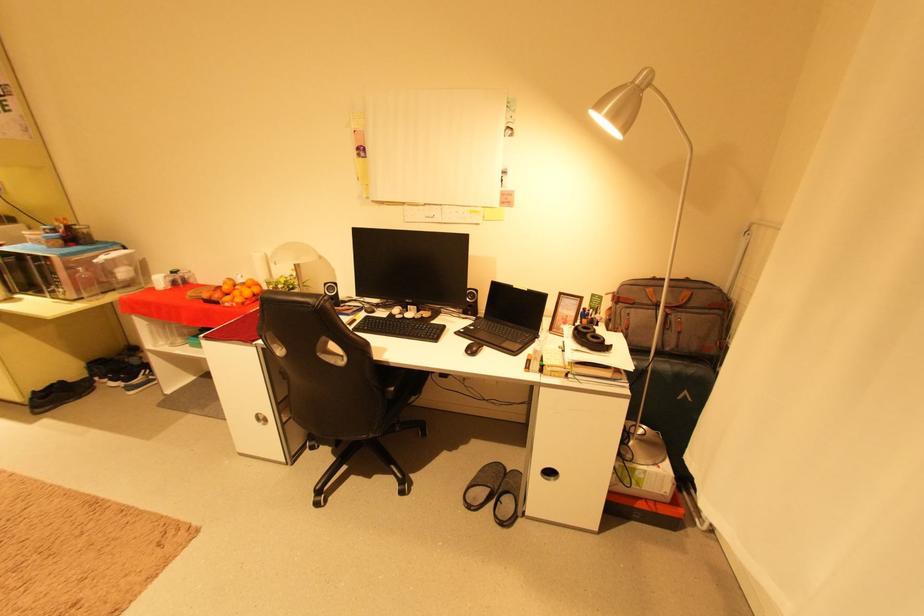
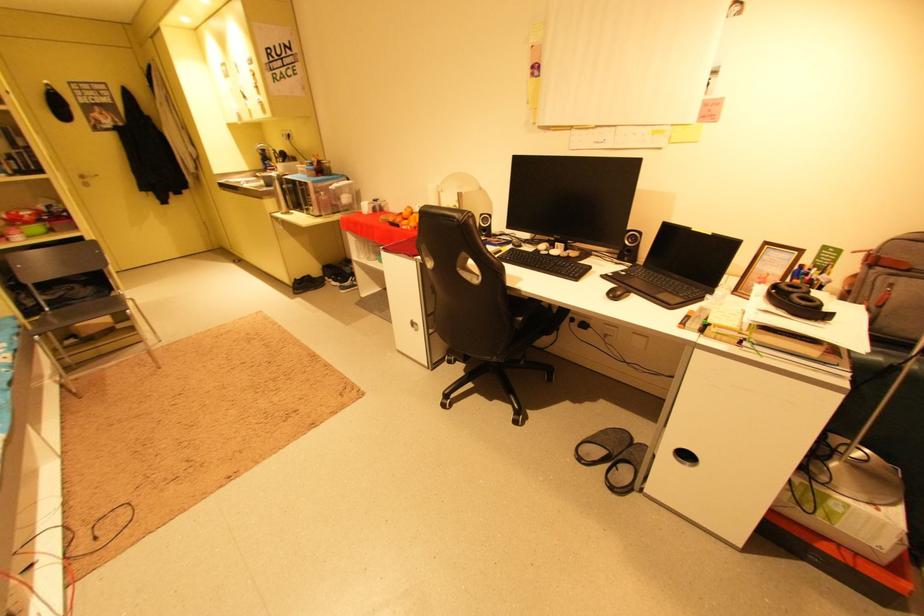
Find the pixel in the second image that matches (x=504, y=492) in the first image.

(623, 456)